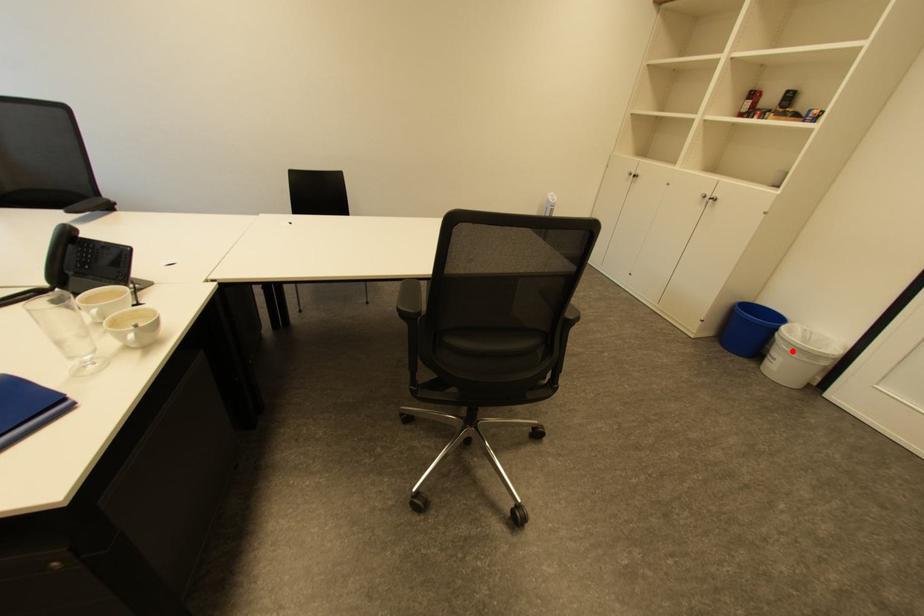
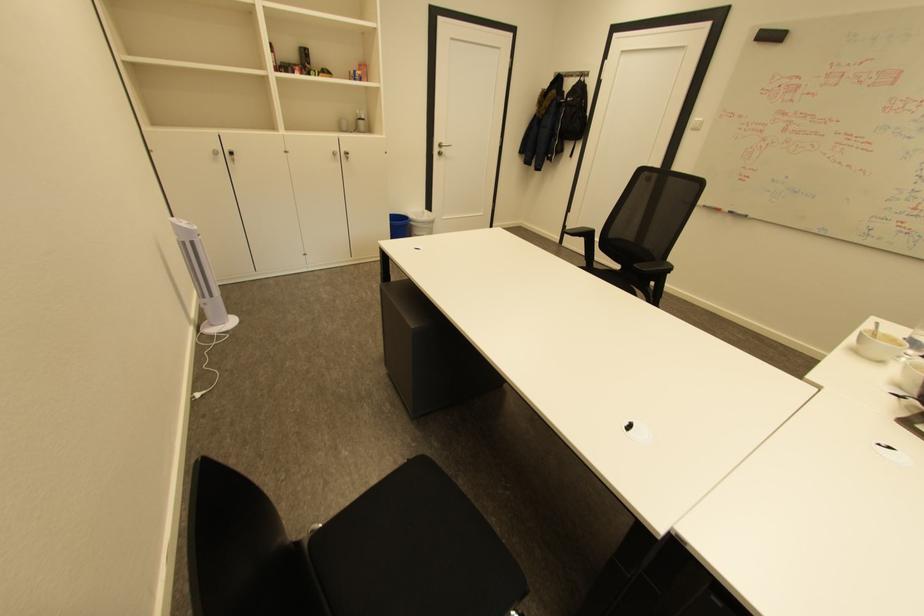
Question: A red point is marked in image1. In image2, is the corresponding 3D point closer to the camera or farther? Reply with the corresponding letter.

Choices:
 (A) The corresponding 3D point is closer.
 (B) The corresponding 3D point is farther.

Answer: (A)